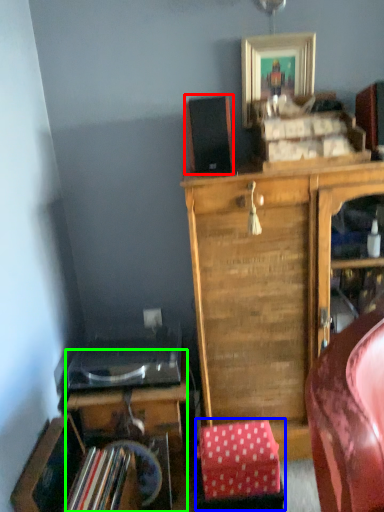
Question: Estimate the real-world distances between objects in this image. Which object is farther from speaker (highlighted by a red box), stool (highlighted by a blue box) or desk (highlighted by a green box)?

Choices:
 (A) stool
 (B) desk

Answer: (A)